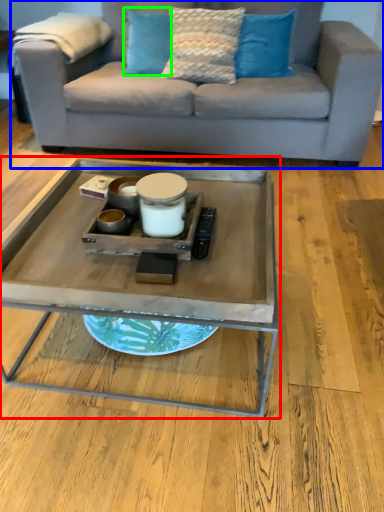
Question: Which object is positioned farthest from coffee table (highlighted by a red box)? Select from studio couch (highlighted by a blue box) and pillow (highlighted by a green box).

Choices:
 (A) studio couch
 (B) pillow

Answer: (B)